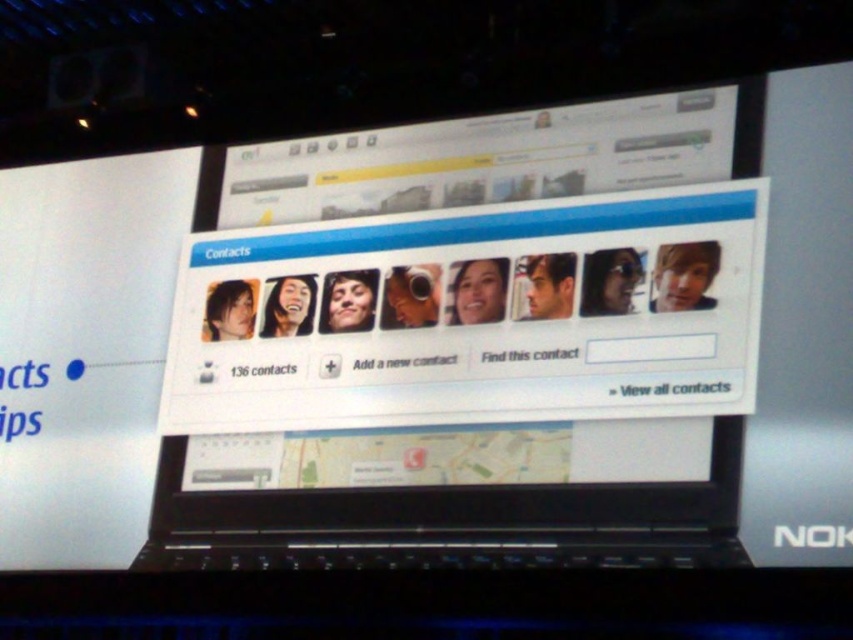
Question: Which object appears closest to the camera in this image?

Choices:
 (A) black plastic nokia logo at center
 (B) black plastic laptop at center

Answer: (A)

Question: Considering the relative positions of black plastic laptop at center and black plastic nokia logo at center in the image provided, where is black plastic laptop at center located with respect to black plastic nokia logo at center?

Choices:
 (A) left
 (B) right

Answer: (A)

Question: Is black plastic laptop at center positioned behind black plastic nokia logo at center?

Choices:
 (A) yes
 (B) no

Answer: (A)

Question: Where is black plastic laptop at center located in relation to black plastic nokia logo at center in the image?

Choices:
 (A) right
 (B) left

Answer: (B)